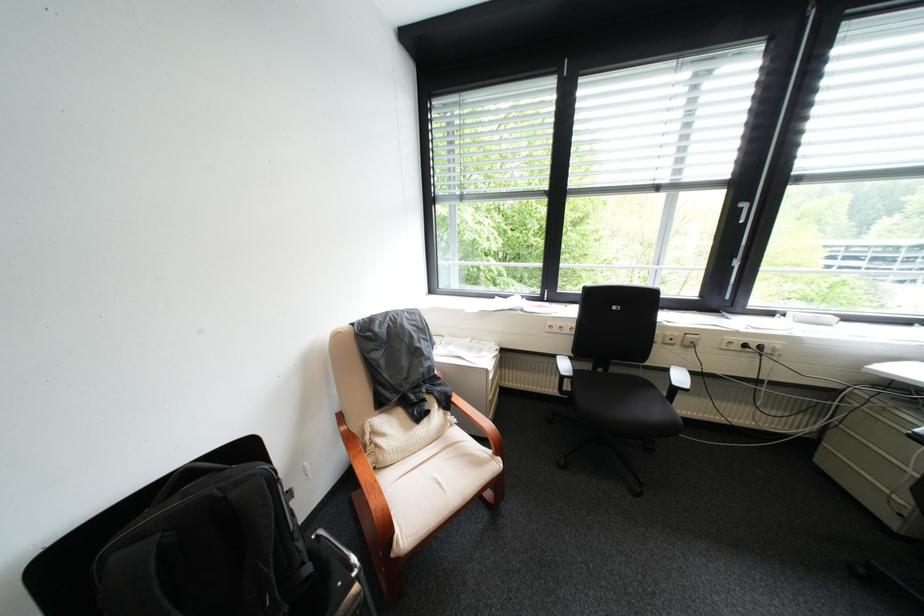
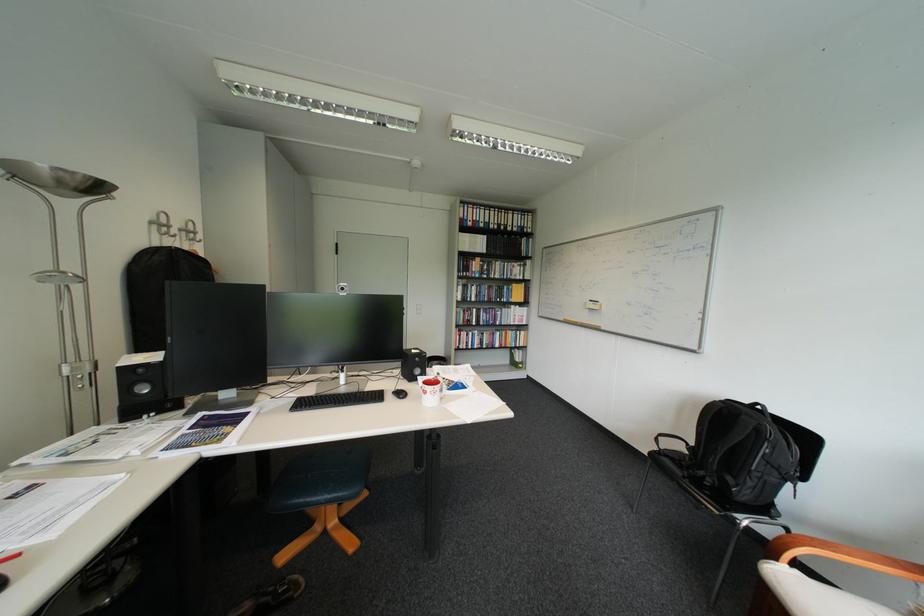
Question: I am providing you with two images of the same scene from different viewpoints. Please identify which objects are invisible in image2.

Choices:
 (A) white chair sitting surface
 (B) black computer keyboard
 (C) black hanging backpack
 (D) none of these

Answer: (D)